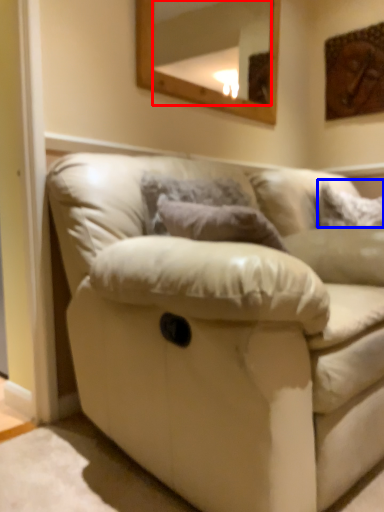
Question: Among these objects, which one is nearest to the camera, mirror (highlighted by a red box) or pillow (highlighted by a blue box)?

Choices:
 (A) mirror
 (B) pillow

Answer: (A)